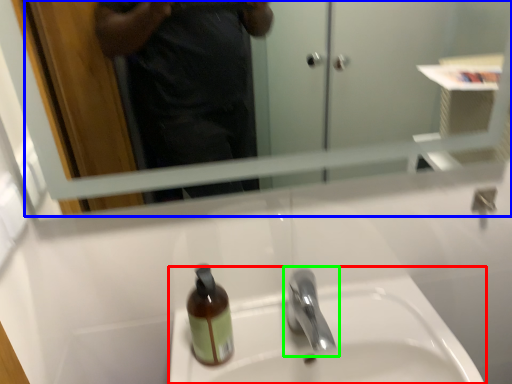
Question: Which is nearer to the sink (highlighted by a red box)? mirror (highlighted by a blue box) or tap (highlighted by a green box).

Choices:
 (A) mirror
 (B) tap

Answer: (B)